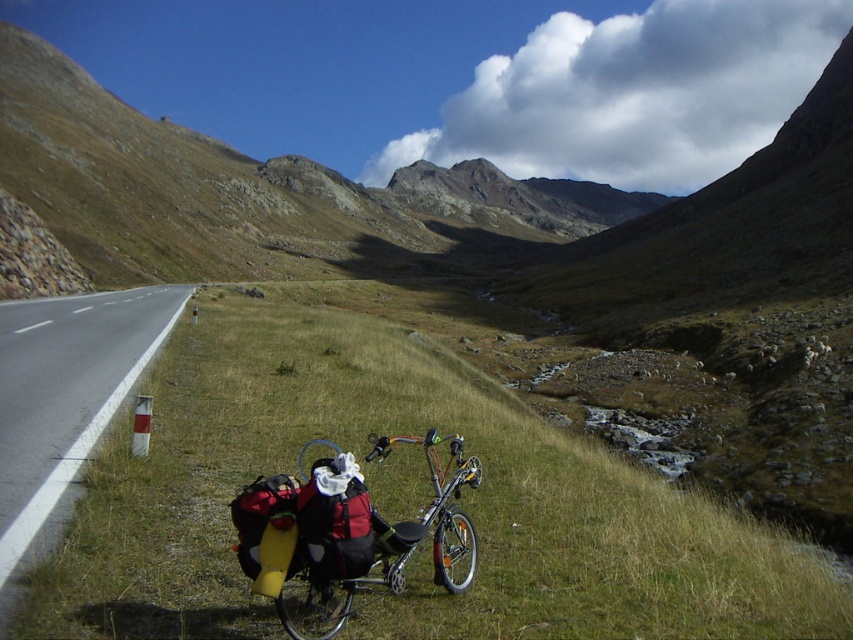
Looking at this image, you are a hiker planning to take a photo of the rugged stone mountain at center and the white asphalt road at lower left. Which object should you focus on first if you want to capture both in a single frame without moving the camera?

You should focus on the rugged stone mountain at center first because the white asphalt road at lower left is behind it, ensuring both will be in the frame when the mountain is in focus.

You are a hiker planning to ride your bicycle along the road shown in the image. You notice the shiny metallic bicycle at lower center and the rugged stone mountain at center. Which object would you see first as you approach the scene from the direction of the road?

The rugged stone mountain at center would be seen first because the shiny metallic bicycle at lower center is positioned behind it.